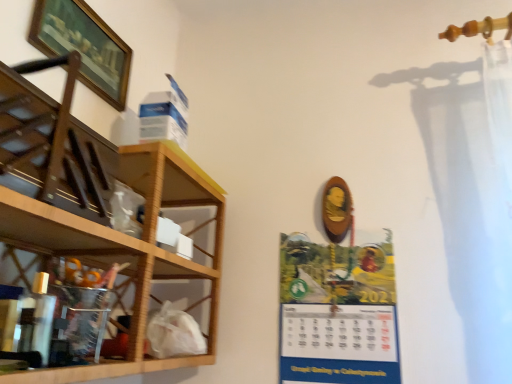
Question: In the image, is matte paper calendar at center-right on the left side or the right side of translucent plastic cabinet at left?

Choices:
 (A) right
 (B) left

Answer: (A)

Question: Is matte paper calendar at center-right situated inside translucent plastic cabinet at left or outside?

Choices:
 (A) outside
 (B) inside

Answer: (A)

Question: Estimate the real-world distances between objects in this image. Which object is closer to the matte paper calendar at center-right?

Choices:
 (A) translucent plastic cabinet at left
 (B) wooden framed picture at upper left
 (C) wooden at left

Answer: (C)

Question: Estimate the real-world distances between objects in this image. Which object is closer to the wooden at left?

Choices:
 (A) matte paper calendar at center-right
 (B) translucent plastic cabinet at left
 (C) wooden framed picture at upper left

Answer: (B)